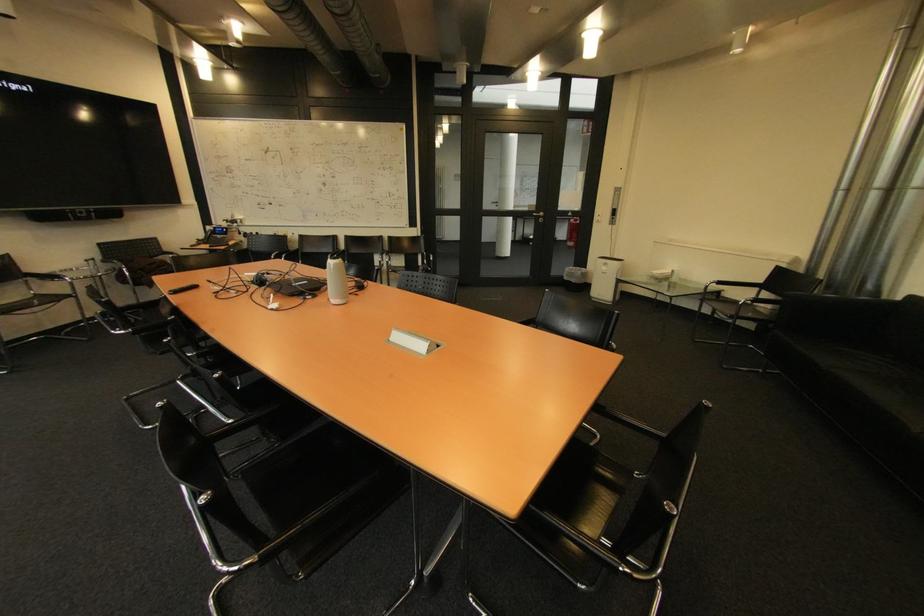
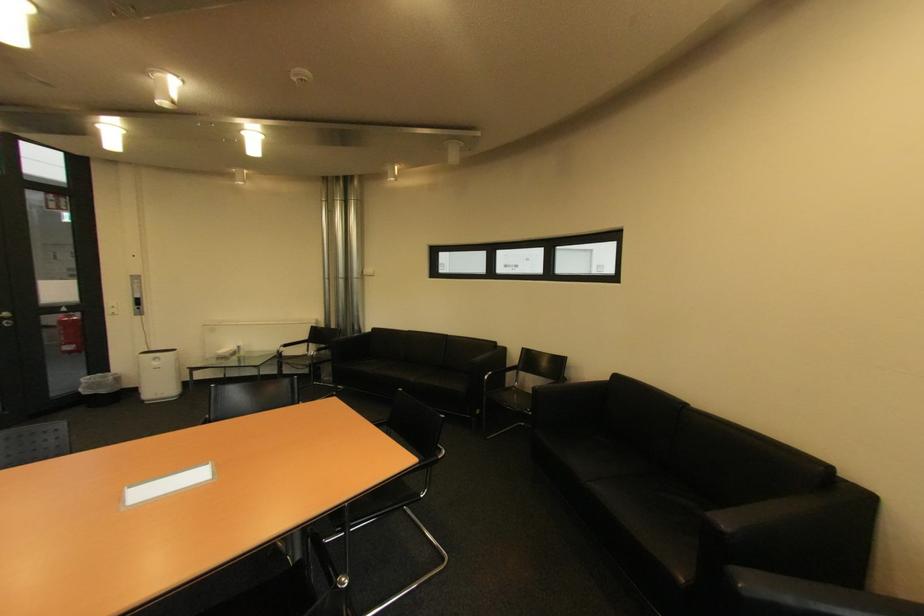
Find the pixel in the second image that matches the point at 623,195 in the first image.

(140, 283)